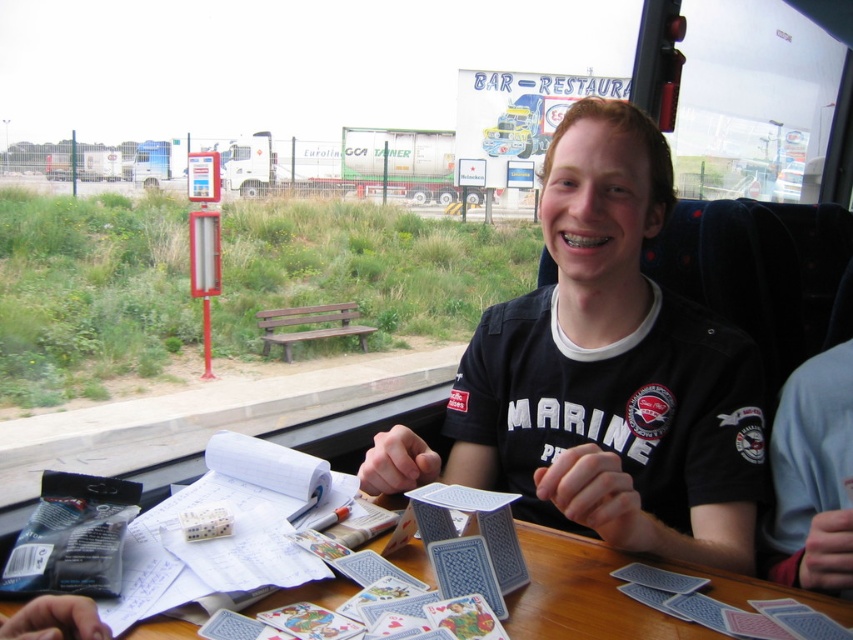
Question: Which point is farther to the camera?

Choices:
 (A) blue plastic table at center
 (B) blue fabric shirt at right

Answer: (B)

Question: Among these points, which one is farthest from the camera?

Choices:
 (A) (813, 496)
 (B) (741, 385)

Answer: (B)

Question: Is blue fabric shirt at right above blue plastic table at center?

Choices:
 (A) yes
 (B) no

Answer: (A)

Question: Which of these objects is positioned farthest from the blue plastic table at center?

Choices:
 (A) blue glossy playing cards at center
 (B) blue fabric shirt at right

Answer: (A)

Question: Is blue glossy playing cards at center wider than blue fabric shirt at right?

Choices:
 (A) yes
 (B) no

Answer: (A)

Question: Is blue fabric shirt at right positioned before blue plastic table at center?

Choices:
 (A) no
 (B) yes

Answer: (A)